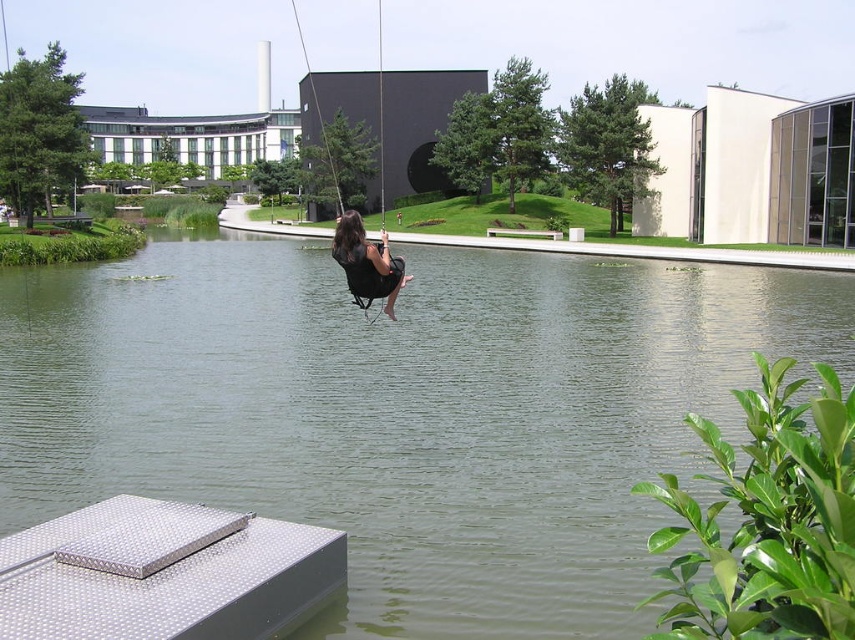
You are standing on the metallic platform in the foreground and want to jump into the water. Which object, the green water at center or the matte black swing at center, is higher from your current position?

The green water at center is taller than the matte black swing at center, so the green water at center is higher from your current position.

You are planning to take a photo of the black fabric swing at center and the matte black swing at center. Since you want to capture both swings clearly in the frame, which swing should you focus on first to ensure proper focus, considering their sizes?

The black fabric swing at center has a larger size compared to matte black swing at center, so you should focus on the black fabric swing at center first to ensure proper focus since it takes up more space in the frame.